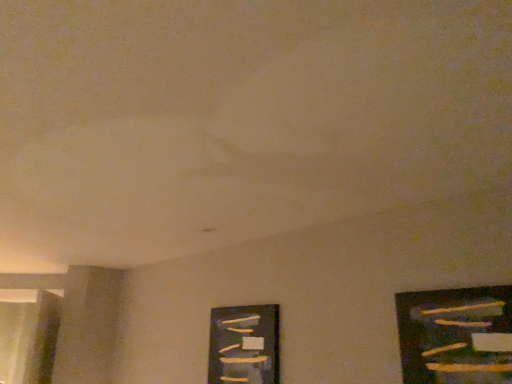
Question: Does wooden frame at lower center, which is the first picture frame from left to right, have a smaller size compared to wooden frame at right, positioned as the first picture frame in front-to-back order?

Choices:
 (A) no
 (B) yes

Answer: (A)

Question: Considering the relative sizes of wooden frame at lower center, placed as the 2th picture frame when sorted from right to left, and wooden frame at right, arranged as the 2th picture frame when viewed from the back, in the image provided, is wooden frame at lower center, placed as the 2th picture frame when sorted from right to left, shorter than wooden frame at right, arranged as the 2th picture frame when viewed from the back,?

Choices:
 (A) yes
 (B) no

Answer: (B)

Question: Can we say wooden frame at lower center, positioned as the 2th picture frame in front-to-back order, lies outside wooden frame at right, which ranks as the second picture frame in left-to-right order?

Choices:
 (A) no
 (B) yes

Answer: (B)

Question: From the image's perspective, would you say wooden frame at lower center, placed as the 2th picture frame when sorted from right to left, is positioned over wooden frame at right, the first picture frame positioned from the right?

Choices:
 (A) no
 (B) yes

Answer: (A)

Question: Is wooden frame at lower center, the first picture frame from the back, facing away from wooden frame at right, the first picture frame positioned from the right?

Choices:
 (A) no
 (B) yes

Answer: (A)

Question: Is wooden frame at lower center, which is the first picture frame from left to right, to the right of wooden frame at right, positioned as the first picture frame in front-to-back order, from the viewer's perspective?

Choices:
 (A) no
 (B) yes

Answer: (A)

Question: Is wooden frame at right, arranged as the 2th picture frame when viewed from the back, facing towards wooden frame at lower center, positioned as the 2th picture frame in front-to-back order?

Choices:
 (A) no
 (B) yes

Answer: (A)

Question: Can you confirm if wooden frame at right, arranged as the 2th picture frame when viewed from the back, is thinner than wooden frame at lower center, placed as the 2th picture frame when sorted from right to left?

Choices:
 (A) no
 (B) yes

Answer: (B)

Question: Is wooden frame at lower center, placed as the 2th picture frame when sorted from right to left, located within wooden frame at right, positioned as the first picture frame in front-to-back order?

Choices:
 (A) no
 (B) yes

Answer: (A)

Question: Can you confirm if wooden frame at right, arranged as the 2th picture frame when viewed from the back, is shorter than wooden frame at lower center, positioned as the 2th picture frame in front-to-back order?

Choices:
 (A) no
 (B) yes

Answer: (B)

Question: Is wooden frame at right, arranged as the 2th picture frame when viewed from the back, outside of wooden frame at lower center, the first picture frame from the back?

Choices:
 (A) yes
 (B) no

Answer: (A)

Question: From the image's perspective, would you say wooden frame at right, the first picture frame positioned from the right, is positioned over wooden frame at lower center, placed as the 2th picture frame when sorted from right to left?

Choices:
 (A) no
 (B) yes

Answer: (B)

Question: Is wooden frame at lower center, which is the first picture frame from left to right, bigger or smaller than wooden frame at right, positioned as the first picture frame in front-to-back order?

Choices:
 (A) small
 (B) big

Answer: (B)